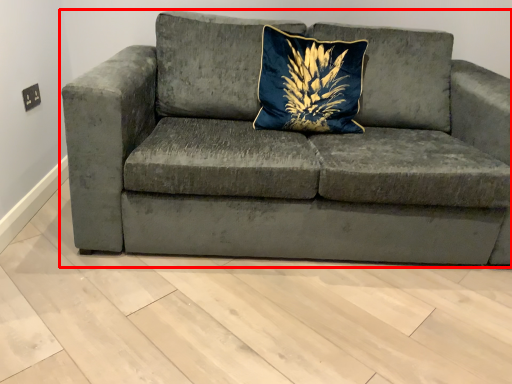
Question: Where is studio couch (annotated by the red box) located in relation to pillow in the image?

Choices:
 (A) right
 (B) left

Answer: (B)